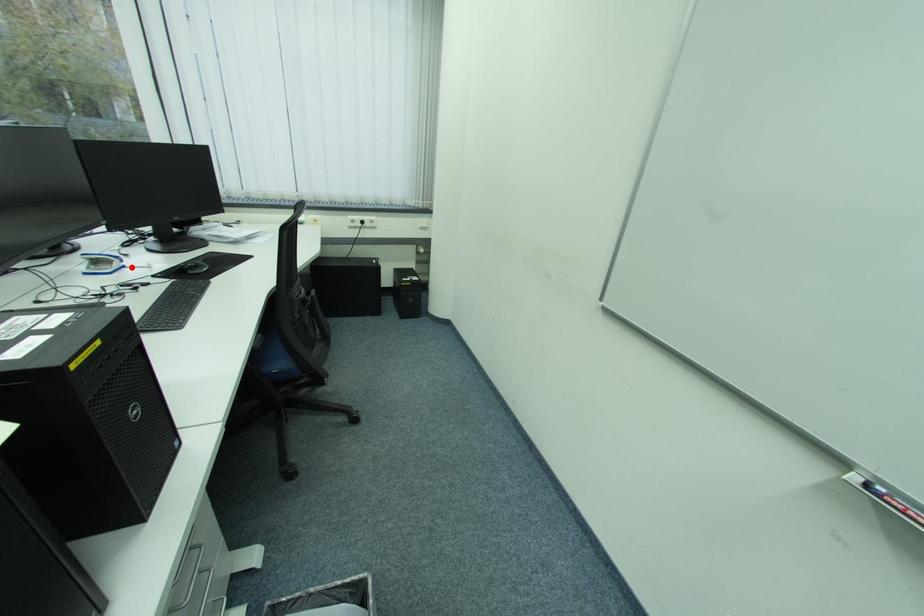
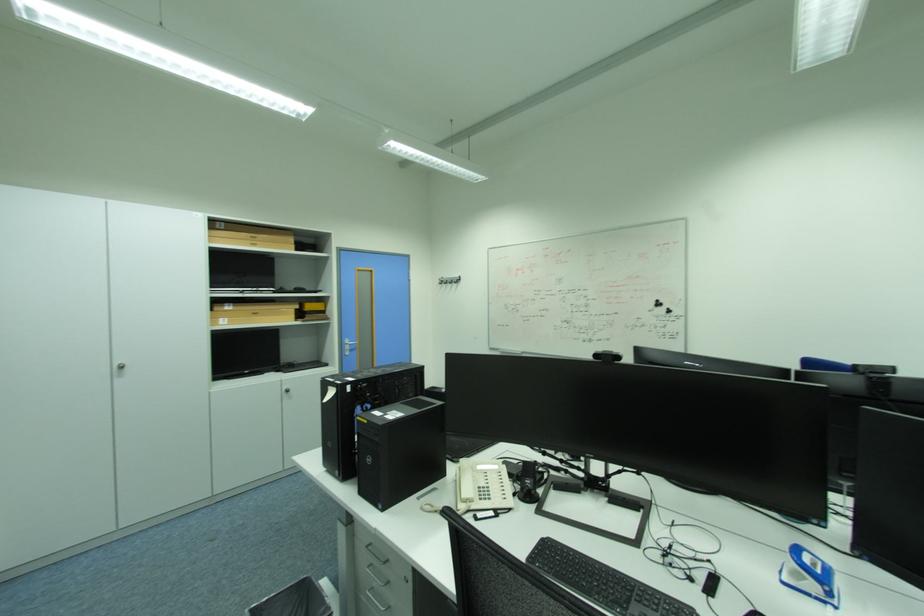
In the second image, find the point that corresponds to the highlighted location in the first image.

(833, 604)